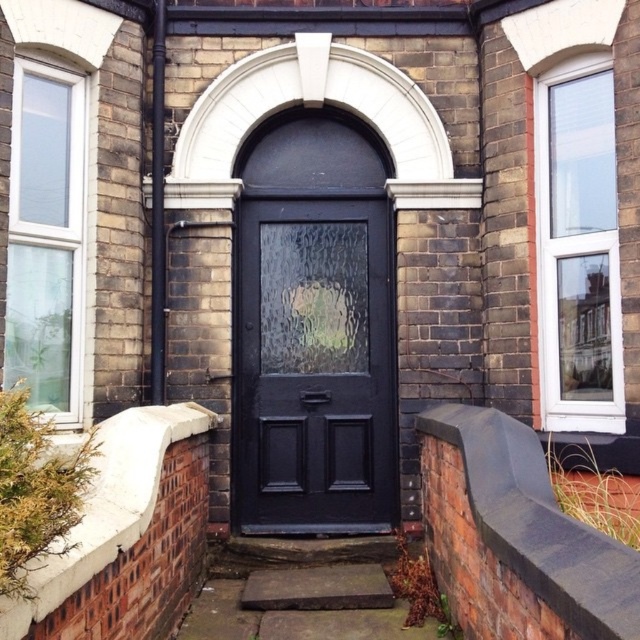
You are standing in front of the brick building and want to enter through the matte black door at center. Based on the coordinates provided, is the door positioned closer to the left or right side of the building?

The matte black door at center is located at point coordinates where the x value is 0.572, which is slightly to the right of the center point. Therefore, the door is positioned closer to the right side of the building.

You are a painter who needs to know the relative heights of the objects in the scene to plan your work. Which object is taller between the matte black door at center and the smooth concrete step at center?

The matte black door at center is much taller than the smooth concrete step at center.